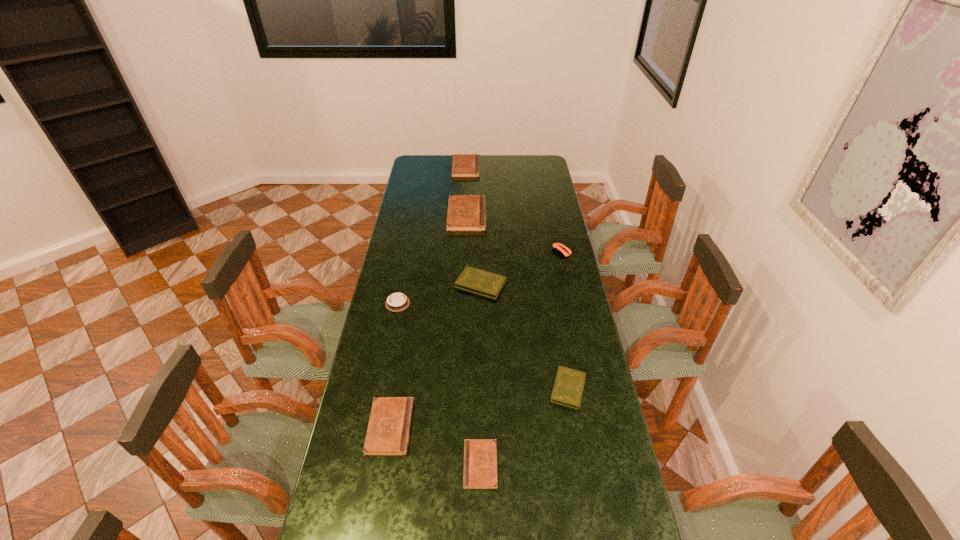
This screenshot has width=960, height=540. What are the coordinates of `vacant area that lies between the second smallest brown diary and the chocolate cake` in the screenshot? It's located at (394, 365).

This screenshot has width=960, height=540. What are the coordinates of `free spot between the biggest brown diary and the third farthest object` in the screenshot? It's located at (514, 233).

Locate an element on the screen. The image size is (960, 540). vacant area between the smaller green diary and the seventh nearest object is located at coordinates (517, 302).

Locate an element on the screen. This screenshot has height=540, width=960. object identified as the seventh closest to the smaller green diary is located at coordinates (464, 165).

I want to click on object that stands as the fourth closest to the leftmost brown diary, so [474, 280].

You are a GUI agent. You are given a task and a screenshot of the screen. Output one action in this format:
    pyautogui.click(x=<x>, y=<y>)
    Task: Click on the diary object that ranks as the second closest to the bigger green diary
    
    Given the screenshot: What is the action you would take?
    pyautogui.click(x=568, y=388)

Find the location of a particular element. This screenshot has width=960, height=540. diary that stands as the fourth closest to the farthest diary is located at coordinates (388, 432).

The width and height of the screenshot is (960, 540). Identify the location of the closest brown diary to the smaller green diary. (480, 455).

Identify which brown diary is the second closest to the bigger green diary. Please provide its 2D coordinates. Your answer should be formatted as a tuple, i.e. [(x, y)], where the tuple contains the x and y coordinates of a point satisfying the conditions above.

[(388, 432)]

Where is `vacant position in the image that satisfies the following two spatial constraints: 1. on the spine side of the nearer green diary; 2. on the right side of the tallest object`? This screenshot has height=540, width=960. vacant position in the image that satisfies the following two spatial constraints: 1. on the spine side of the nearer green diary; 2. on the right side of the tallest object is located at coordinates (460, 388).